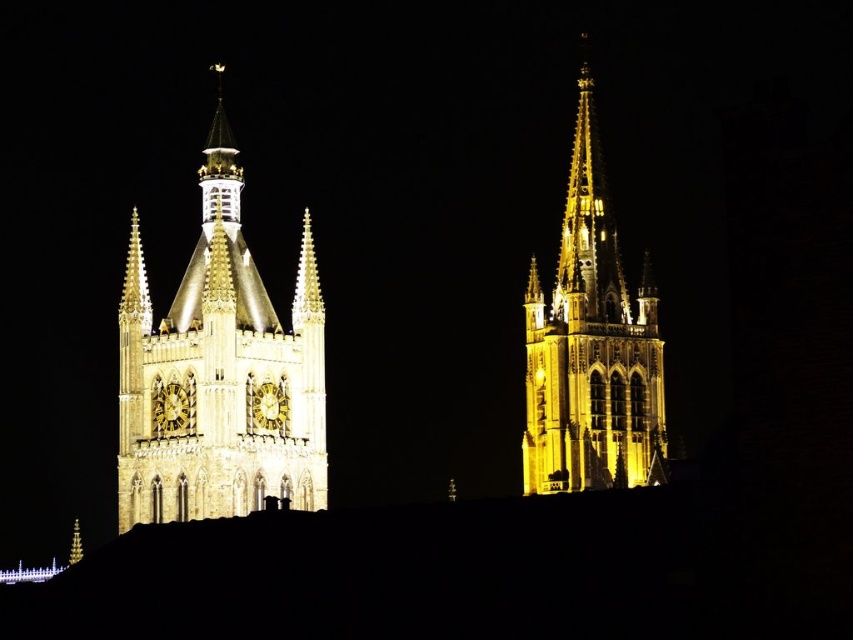
You are standing in front of two Gothic towers at night. You notice a point at coordinates point (215, 376). Which tower does this point belong to?

The point (215, 376) belongs to the golden stone tower at left.

You are standing in front of the two Gothic towers at night. You notice the gold polished spire at upper center. Where exactly is this spire positioned relative to the towers?

The gold polished spire at upper center is located at point coordinates of 0.259 on both the x and y axes, placing it precisely at the upper center position between the two towers.

You are an architect evaluating the structure of the two towers in the image. Which of the two towers, the golden stone tower at upper right or the gold metallic spire at center, would you estimate to be taller based on their sizes in the image?

The golden stone tower at upper right is larger in size compared to the gold metallic spire at center, so it would be taller.